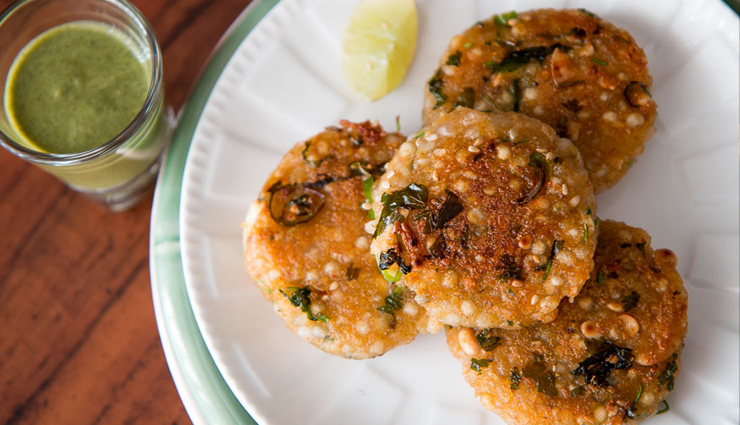
Show me where what i'd put food on are located in the image. Your answer should be formatted as a list of tuples, i.e. [(x1, y1), (x2, y2), ...], where each tuple contains the x and y coordinates of a point satisfying the conditions above.

[(386, 390), (225, 212), (271, 103), (667, 198)]